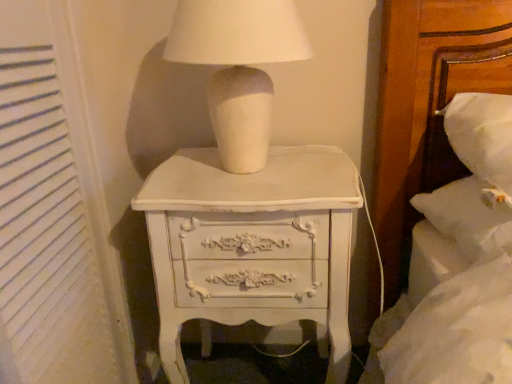
Question: From the image's perspective, is white matte ceramic lamp at upper center beneath white textured curtain at left?

Choices:
 (A) yes
 (B) no

Answer: (B)

Question: Does white matte ceramic lamp at upper center lie in front of white textured curtain at left?

Choices:
 (A) no
 (B) yes

Answer: (A)

Question: Does white matte ceramic lamp at upper center have a larger size compared to white textured curtain at left?

Choices:
 (A) no
 (B) yes

Answer: (B)

Question: From a real-world perspective, is white matte ceramic lamp at upper center located beneath white textured curtain at left?

Choices:
 (A) no
 (B) yes

Answer: (A)

Question: Can you confirm if white matte ceramic lamp at upper center is taller than white textured curtain at left?

Choices:
 (A) no
 (B) yes

Answer: (A)

Question: In terms of height, does white matte ceramic lamp at upper center look taller or shorter compared to white textured curtain at left?

Choices:
 (A) short
 (B) tall

Answer: (A)

Question: Is white matte ceramic lamp at upper center in front of or behind white textured curtain at left in the image?

Choices:
 (A) front
 (B) behind

Answer: (B)

Question: From the image's perspective, is white matte ceramic lamp at upper center positioned above or below white textured curtain at left?

Choices:
 (A) above
 (B) below

Answer: (A)

Question: Visually, is white matte ceramic lamp at upper center positioned to the left or to the right of white textured curtain at left?

Choices:
 (A) right
 (B) left

Answer: (A)

Question: Would you say white painted wood chest of drawers at center is to the left or to the right of white textured curtain at left in the picture?

Choices:
 (A) left
 (B) right

Answer: (B)

Question: Considering the positions of white painted wood chest of drawers at center and white textured curtain at left in the image, is white painted wood chest of drawers at center wider or thinner than white textured curtain at left?

Choices:
 (A) thin
 (B) wide

Answer: (B)

Question: Would you say white painted wood chest of drawers at center is inside or outside white textured curtain at left?

Choices:
 (A) outside
 (B) inside

Answer: (A)

Question: Is white painted wood chest of drawers at center bigger or smaller than white textured curtain at left?

Choices:
 (A) small
 (B) big

Answer: (B)

Question: In the image, is white painted wood chest of drawers at center positioned in front of or behind white matte ceramic lamp at upper center?

Choices:
 (A) front
 (B) behind

Answer: (B)

Question: Is white painted wood chest of drawers at center bigger or smaller than white matte ceramic lamp at upper center?

Choices:
 (A) small
 (B) big

Answer: (B)